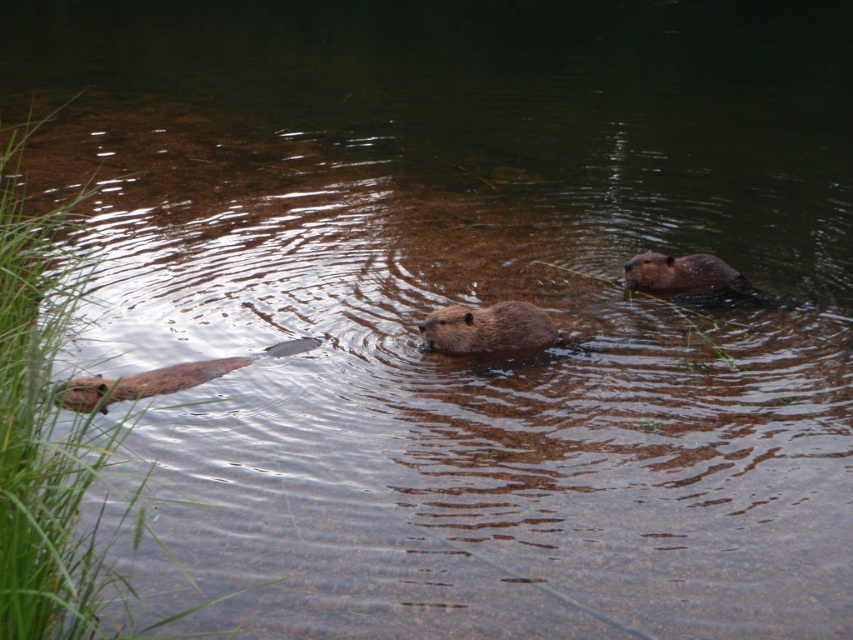
Question: Is brown furry beaver at center thinner than brown furry beaver at upper right?

Choices:
 (A) no
 (B) yes

Answer: (B)

Question: Can you confirm if brown furry beaver at center is thinner than brown furry beaver at upper right?

Choices:
 (A) yes
 (B) no

Answer: (A)

Question: Is brown furry beaver at center to the right of brown furry beaver at upper right from the viewer's perspective?

Choices:
 (A) no
 (B) yes

Answer: (A)

Question: Which of the following is the farthest from the observer?

Choices:
 (A) (669, 291)
 (B) (469, 317)

Answer: (A)